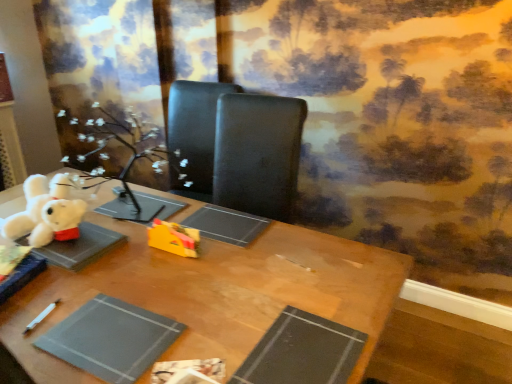
At what (x,y) coordinates should I click in order to perform the action: click on free space between black matte paperback book at lower center, marked as the second paperback book in a left-to-right arrangement, and white plush bear at upper left, arranged as the 1th toy when viewed from the left. Please return your answer as a coordinate pair (x, y). The width and height of the screenshot is (512, 384). Looking at the image, I should click on (170, 291).